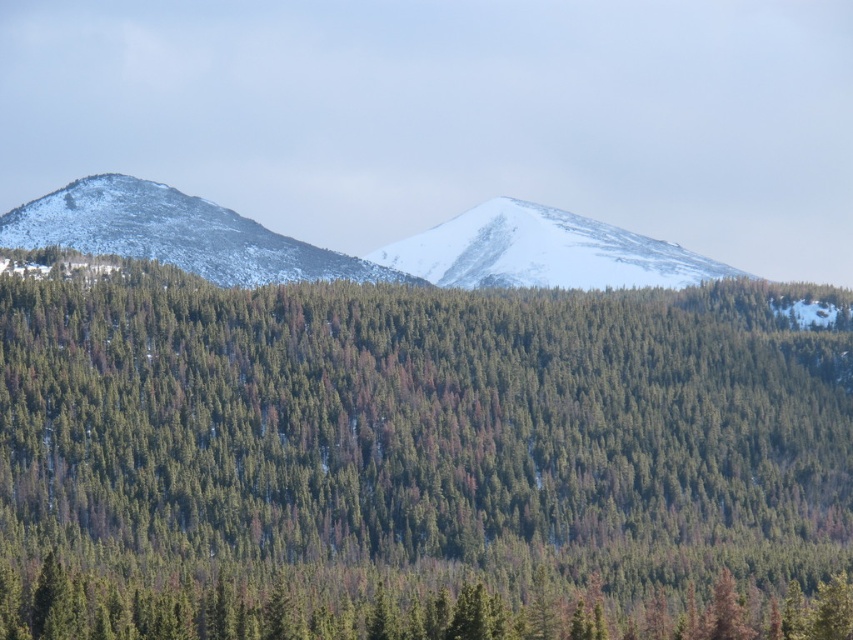
Is green matte tree at center behind white snow-covered mountain at center?

No.

Between point (263, 435) and point (582, 216), which one is positioned in front?

Point (263, 435) is more forward.

Identify the location of green matte tree at center. (415, 458).

Between green matte tree at center and snowy white mountain at left, which one has more height?

green matte tree at center is taller.

Can you confirm if green matte tree at center is positioned to the left of snowy white mountain at left?

In fact, green matte tree at center is to the right of snowy white mountain at left.

Is point (421, 461) positioned before point (332, 266)?

That is True.

Locate an element on the screen. green matte tree at center is located at coordinates (415, 458).

Does snowy white mountain at left have a larger size compared to white snow-covered mountain at center?

Actually, snowy white mountain at left might be smaller than white snow-covered mountain at center.

Does point (164, 204) lie behind point (421, 250)?

No, (164, 204) is in front of (421, 250).

At what (x,y) coordinates should I click in order to perform the action: click on snowy white mountain at left. Please return your answer as a coordinate pair (x, y). The width and height of the screenshot is (853, 640). Looking at the image, I should click on (177, 234).